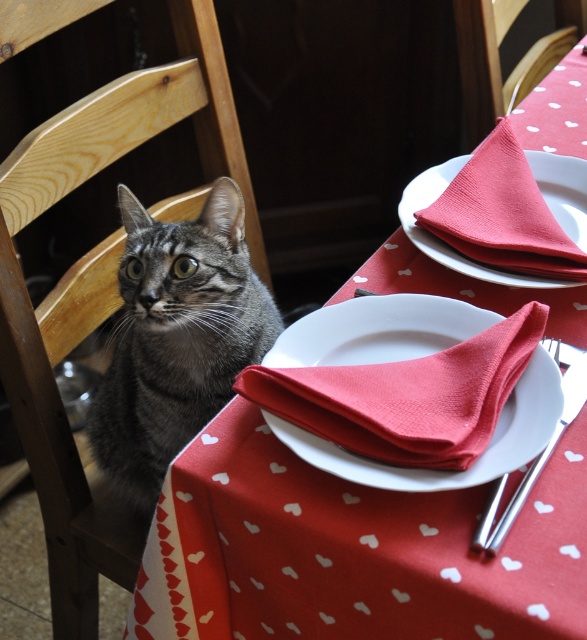
You are a photographer trying to capture the tabby cat in the scene. The cat is currently at point (177, 337). If you want to position the cat exactly in the center of your camera frame, which direction should you move the camera? Please provide your answer based on the coordinates given and the scene description.

The point (177, 337) is on the gray tabby cat at left. Since the cat is on the left side of the scene, you should move the camera to the right to center the cat in the frame.

You are a guest at this table and need to place a small decorative item between the gray tabby cat at left and the red paper napkin at center. Considering their sizes, which object should you place the item closer to?

Since the gray tabby cat at left is larger in size than the red paper napkin at center, you should place the item closer to the red paper napkin at center to ensure it is within reach and not overwhelmed by the cat.